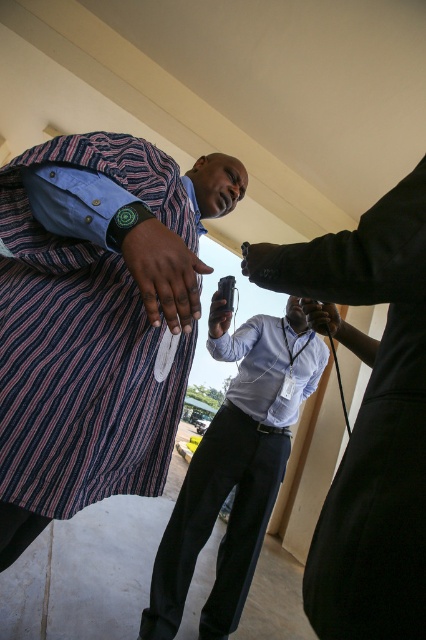
Is striped fabric dress at center bigger than black matte camera at center?

Yes.

Is striped fabric dress at center to the left of black matte camera at center from the viewer's perspective?

Indeed, striped fabric dress at center is positioned on the left side of black matte camera at center.

Which is behind, point (158, 484) or point (256, 278)?

Point (158, 484)

I want to click on striped fabric dress at center, so click(83, 342).

Does striped fabric dress at center have a lesser height compared to dark brown leather hand at center?

No.

Where is `striped fabric dress at center`? The width and height of the screenshot is (426, 640). striped fabric dress at center is located at coordinates (83, 342).

Can you confirm if black matte camera at center is thinner than matte black phone at center?

Yes, black matte camera at center is thinner than matte black phone at center.

Is point (256, 264) farther from viewer compared to point (218, 296)?

No, it is not.

Locate an element on the screen. Image resolution: width=426 pixels, height=640 pixels. black matte camera at center is located at coordinates (256, 257).